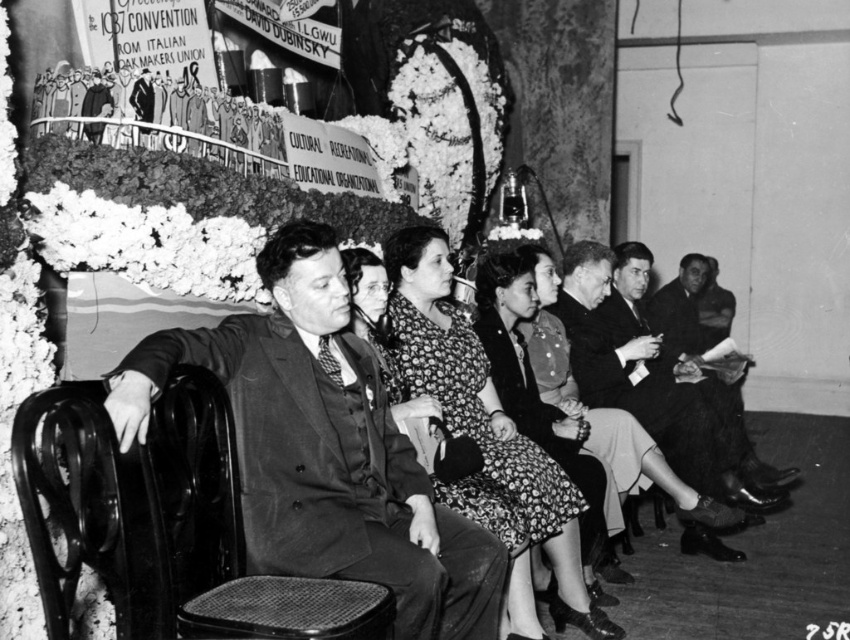
Is smooth black suit at center positioned at the back of floral-patterned dress at center?

No, it is in front of floral-patterned dress at center.

Does point (306, 476) come closer to viewer compared to point (567, 582)?

Yes, it is.

Image resolution: width=850 pixels, height=640 pixels. In order to click on smooth black suit at center in this screenshot , I will do `click(324, 448)`.

Does smooth black suit at center have a lesser width compared to smooth leather jacket at center?

Correct, smooth black suit at center's width is less than smooth leather jacket at center's.

Locate an element on the screen. smooth black suit at center is located at coordinates coord(324,448).

Image resolution: width=850 pixels, height=640 pixels. Identify the location of smooth black suit at center. (324, 448).

Can you confirm if smooth black suit at center is positioned to the right of woven fabric chair at center?

Indeed, smooth black suit at center is positioned on the right side of woven fabric chair at center.

This screenshot has width=850, height=640. What do you see at coordinates (324, 448) in the screenshot?
I see `smooth black suit at center` at bounding box center [324, 448].

Locate an element on the screen. smooth black suit at center is located at coordinates click(x=324, y=448).